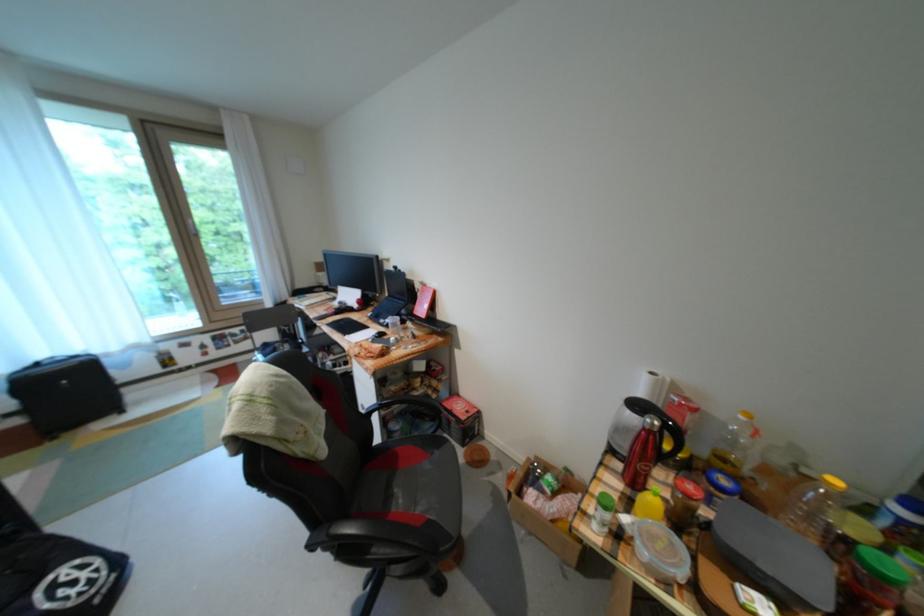
The image size is (924, 616). Identify the location of window handle. (191, 227).